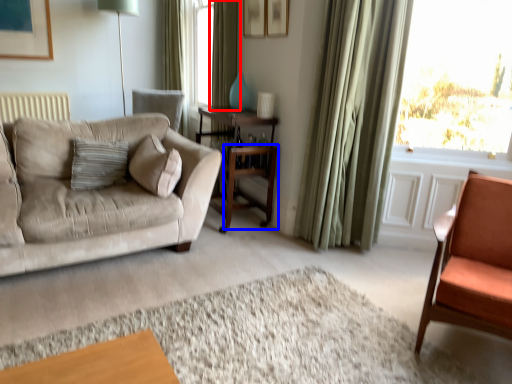
Question: Which object is further to the camera taking this photo, curtain (highlighted by a red box) or table (highlighted by a blue box)?

Choices:
 (A) curtain
 (B) table

Answer: (A)